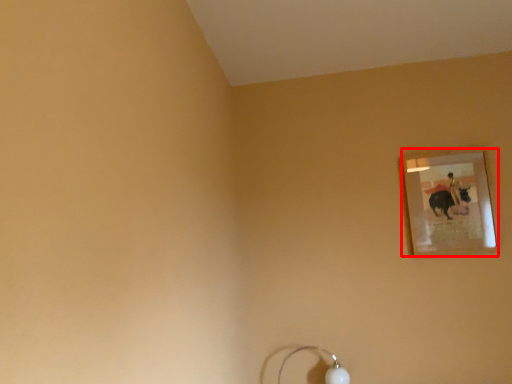
Question: From the image's perspective, what is the correct spatial relationship of picture frame (annotated by the red box) in relation to lamp?

Choices:
 (A) below
 (B) above

Answer: (B)